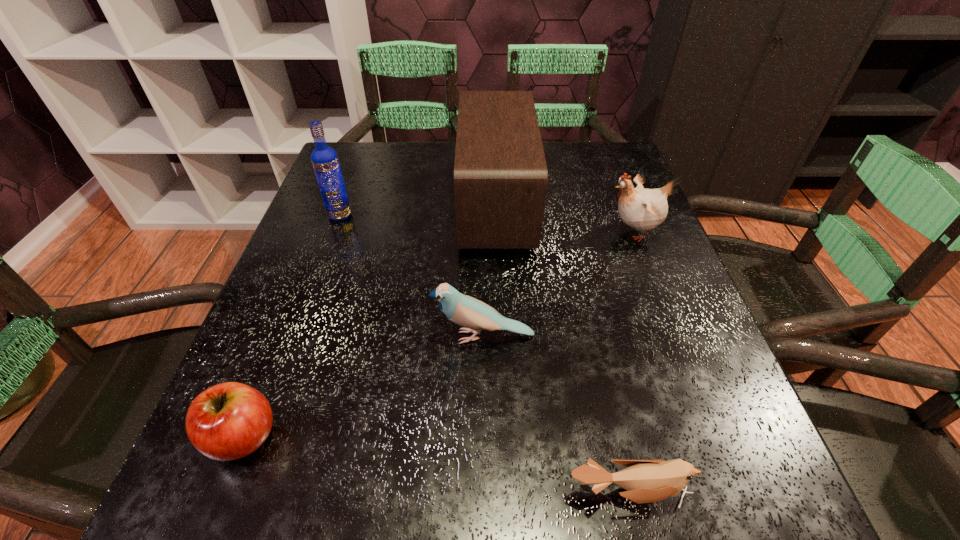
At what (x,y) coordinates should I click in order to perform the action: click on vodka. Please return your answer as a coordinate pair (x, y). Looking at the image, I should click on (325, 161).

I want to click on radio receiver, so click(500, 173).

Where is `the farthest bird`? This screenshot has height=540, width=960. the farthest bird is located at coordinates (643, 209).

Where is `the second farthest bird`? Image resolution: width=960 pixels, height=540 pixels. the second farthest bird is located at coordinates (466, 311).

Identify the location of the leftmost bird. This screenshot has width=960, height=540. (466, 311).

Identify the location of the second nearest object. The image size is (960, 540). (228, 421).

This screenshot has height=540, width=960. Identify the location of the second shortest object. (228, 421).

You are a GUI agent. You are given a task and a screenshot of the screen. Output one action in this format:
    pyautogui.click(x=<x>, y=<y>)
    Task: Click on the nearest object
    
    Given the screenshot: What is the action you would take?
    pyautogui.click(x=646, y=481)

At what (x,y) coordinates should I click in order to perform the action: click on the nearest bird. Please return your answer as a coordinate pair (x, y). This screenshot has height=540, width=960. Looking at the image, I should click on (646, 481).

Identify the location of free location located 0.190m on the front of the vodka. (315, 284).